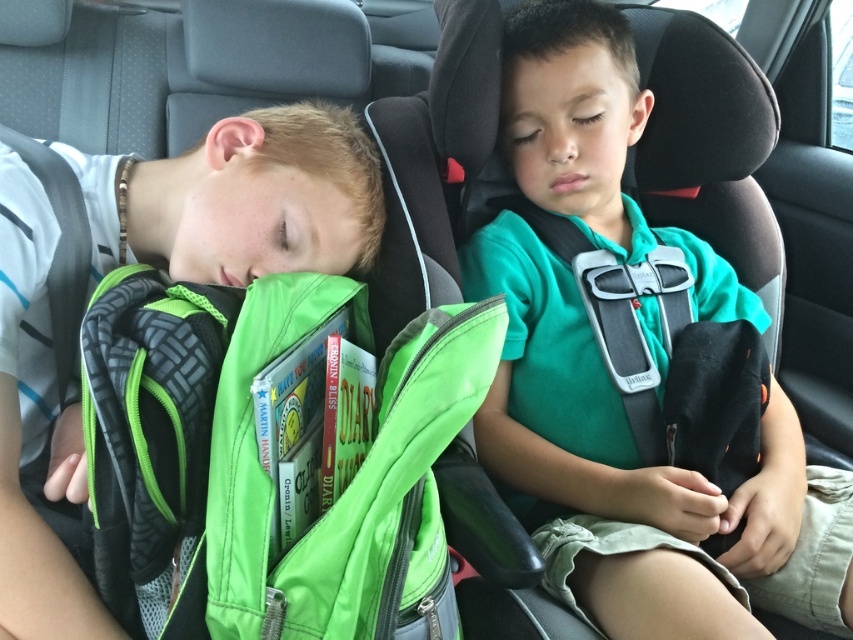
Does green fabric backpack at left have a greater height compared to gray fabric seatbelt at center?

Yes, green fabric backpack at left is taller than gray fabric seatbelt at center.

Where is `green fabric backpack at left`? Image resolution: width=853 pixels, height=640 pixels. green fabric backpack at left is located at coordinates (241, 198).

Is point (245, 246) positioned before point (680, 458)?

Yes, it is in front of point (680, 458).

At what (x,y) coordinates should I click in order to perform the action: click on green fabric backpack at left. Please return your answer as a coordinate pair (x, y). Looking at the image, I should click on (241, 198).

Is green fabric backpack at left thinner than black fabric seatbelt at left?

No, green fabric backpack at left is not thinner than black fabric seatbelt at left.

Can you confirm if green fabric backpack at left is taller than black fabric seatbelt at left?

Yes.

At what (x,y) coordinates should I click in order to perform the action: click on green fabric backpack at left. Please return your answer as a coordinate pair (x, y). Looking at the image, I should click on 241,198.

In the scene shown: Which is more to the left, gray fabric seatbelt at center or black fabric seatbelt at left?

black fabric seatbelt at left is more to the left.

Which is in front, point (561, 227) or point (42, 184)?

Point (42, 184) is in front.

Find the location of a particular element. gray fabric seatbelt at center is located at coordinates (625, 323).